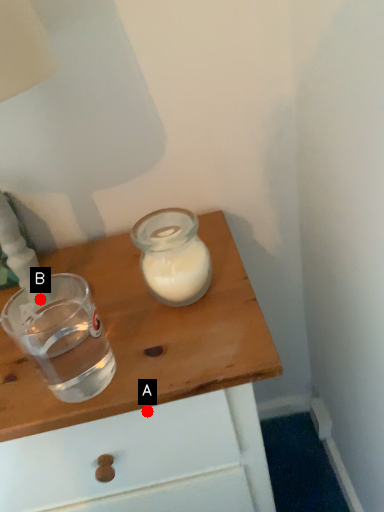
Question: Two points are circled on the image, labeled by A and B beside each circle. Which point is further to the camera?

Choices:
 (A) A is further
 (B) B is further

Answer: (B)